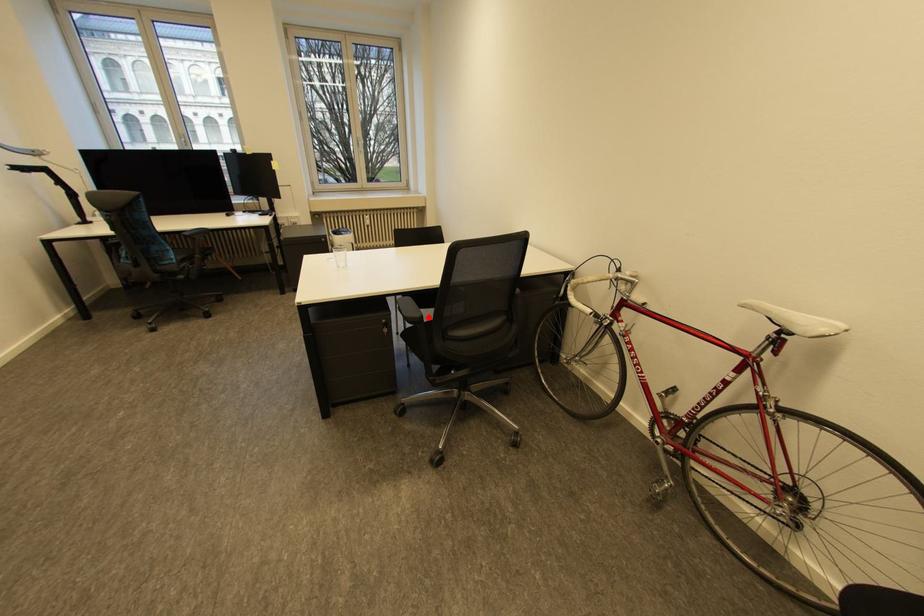
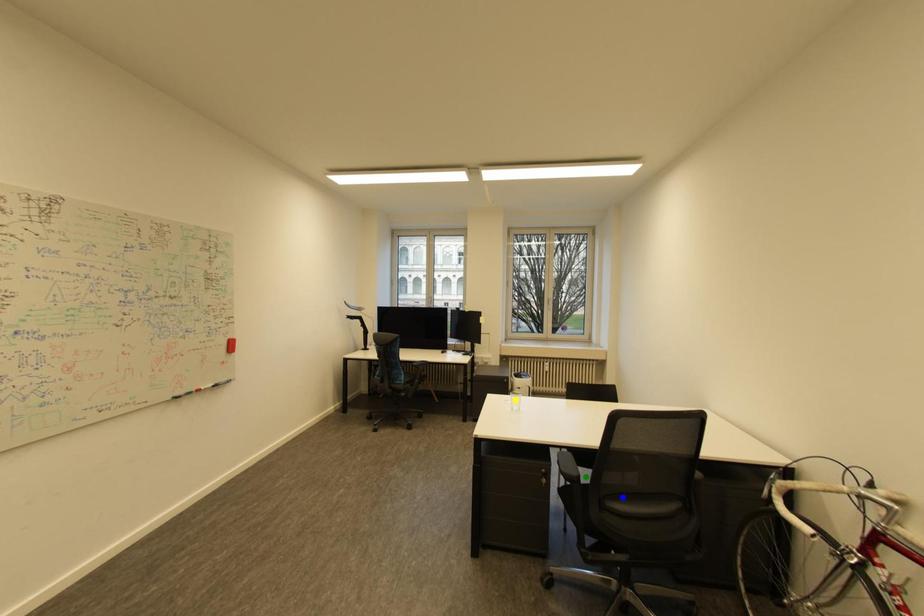
Question: I am providing you with two images of the same scene from different viewpoints. A red point is marked on the first image. You are given multiple points on the second image. Which mark in image 2 goes with the point in image 1?

Choices:
 (A) green point
 (B) yellow point
 (C) blue point

Answer: (A)